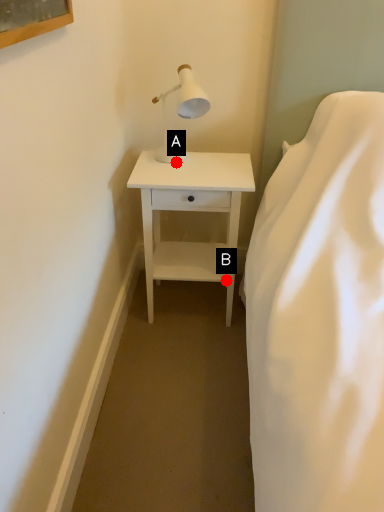
Question: Two points are circled on the image, labeled by A and B beside each circle. Which of the following is the farthest from the observer?

Choices:
 (A) A is further
 (B) B is further

Answer: (B)